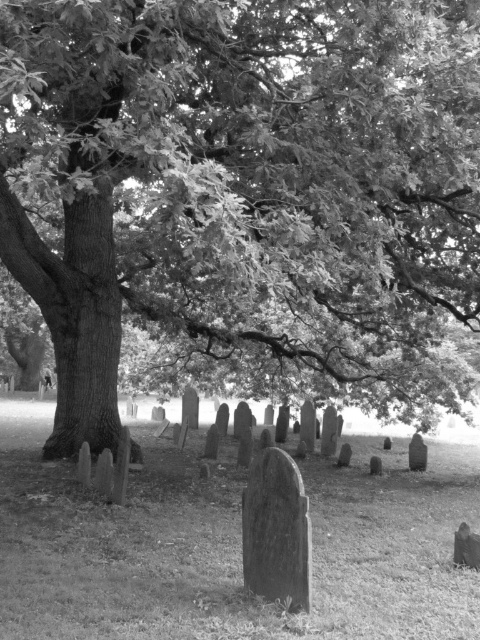
Does smooth bark tree at center appear on the left side of smooth stone gravestone at center?

Indeed, smooth bark tree at center is positioned on the left side of smooth stone gravestone at center.

Is the position of smooth bark tree at center less distant than that of smooth stone gravestone at center?

Yes.

Who is more distant from viewer, (288, 8) or (288, 598)?

Positioned behind is point (288, 8).

Where is `smooth bark tree at center`? smooth bark tree at center is located at coordinates (239, 170).